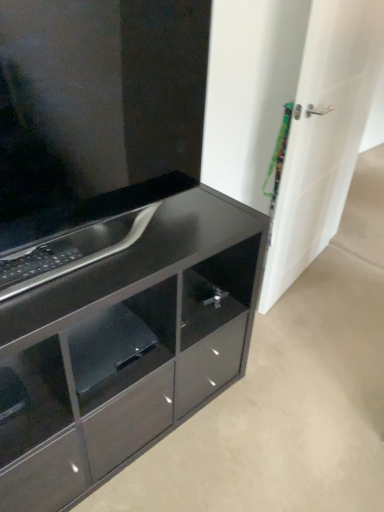
Question: Is the position of white glossy door at right more distant than that of glossy black cabinet at lower left?

Choices:
 (A) no
 (B) yes

Answer: (B)

Question: Considering the relative sizes of white glossy door at right and glossy black cabinet at lower left in the image provided, is white glossy door at right shorter than glossy black cabinet at lower left?

Choices:
 (A) yes
 (B) no

Answer: (B)

Question: Considering the relative sizes of white glossy door at right and glossy black cabinet at lower left in the image provided, is white glossy door at right taller than glossy black cabinet at lower left?

Choices:
 (A) no
 (B) yes

Answer: (B)

Question: Would you say glossy black cabinet at lower left is part of white glossy door at right's contents?

Choices:
 (A) no
 (B) yes

Answer: (A)

Question: Is white glossy door at right looking in the opposite direction of glossy black cabinet at lower left?

Choices:
 (A) no
 (B) yes

Answer: (A)

Question: Relative to white glossy door at right, is glossy black cabinet at lower left in front or behind?

Choices:
 (A) behind
 (B) front

Answer: (B)

Question: Would you say glossy black cabinet at lower left is inside or outside white glossy door at right?

Choices:
 (A) outside
 (B) inside

Answer: (A)

Question: Considering the positions of glossy black cabinet at lower left and white glossy door at right in the image, is glossy black cabinet at lower left wider or thinner than white glossy door at right?

Choices:
 (A) thin
 (B) wide

Answer: (B)

Question: From the image's perspective, is glossy black cabinet at lower left above or below white glossy door at right?

Choices:
 (A) above
 (B) below

Answer: (B)

Question: Is glossy black shelf at lower center to the left or to the right of glossy black cabinet at center in the image?

Choices:
 (A) right
 (B) left

Answer: (B)

Question: In terms of height, does glossy black shelf at lower center look taller or shorter compared to glossy black cabinet at center?

Choices:
 (A) tall
 (B) short

Answer: (B)

Question: Is point (94, 352) positioned closer to the camera than point (135, 76)?

Choices:
 (A) closer
 (B) farther

Answer: (B)

Question: In terms of width, does glossy black shelf at lower center look wider or thinner when compared to glossy black cabinet at center?

Choices:
 (A) wide
 (B) thin

Answer: (A)

Question: Choose the correct answer: Is glossy black cabinet at center inside glossy black shelf at lower center or outside it?

Choices:
 (A) inside
 (B) outside

Answer: (B)

Question: Does point (1, 97) appear closer or farther from the camera than point (110, 325)?

Choices:
 (A) farther
 (B) closer

Answer: (B)